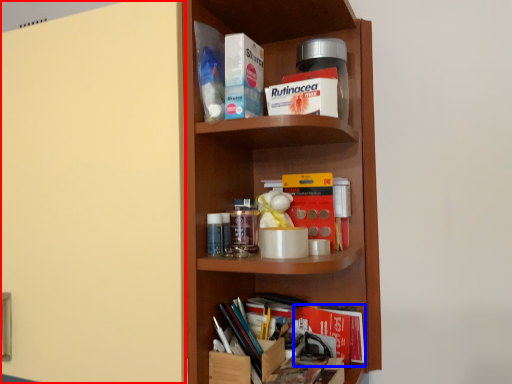
Question: Which of the following is the farthest to the observer, door (highlighted by a red box) or book (highlighted by a blue box)?

Choices:
 (A) door
 (B) book

Answer: (B)